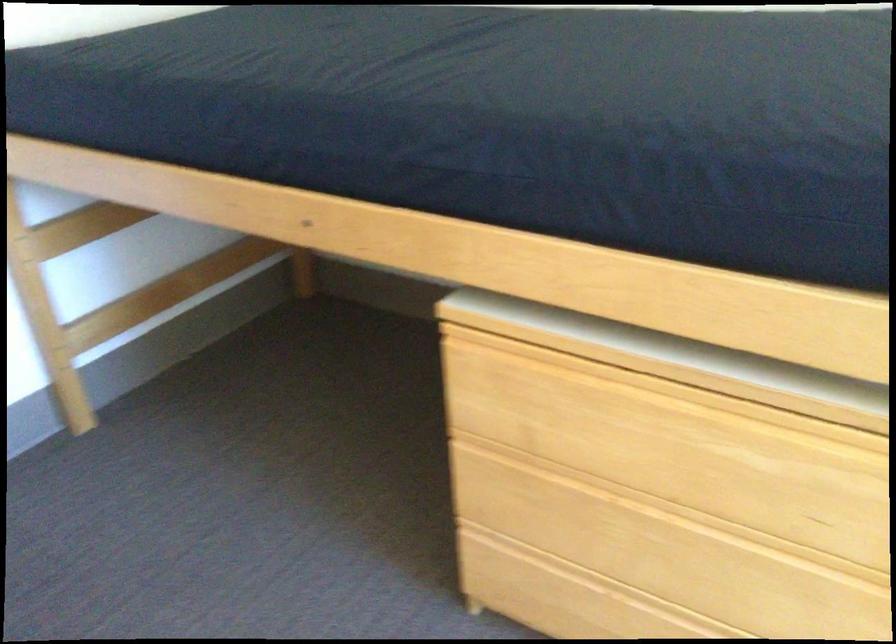
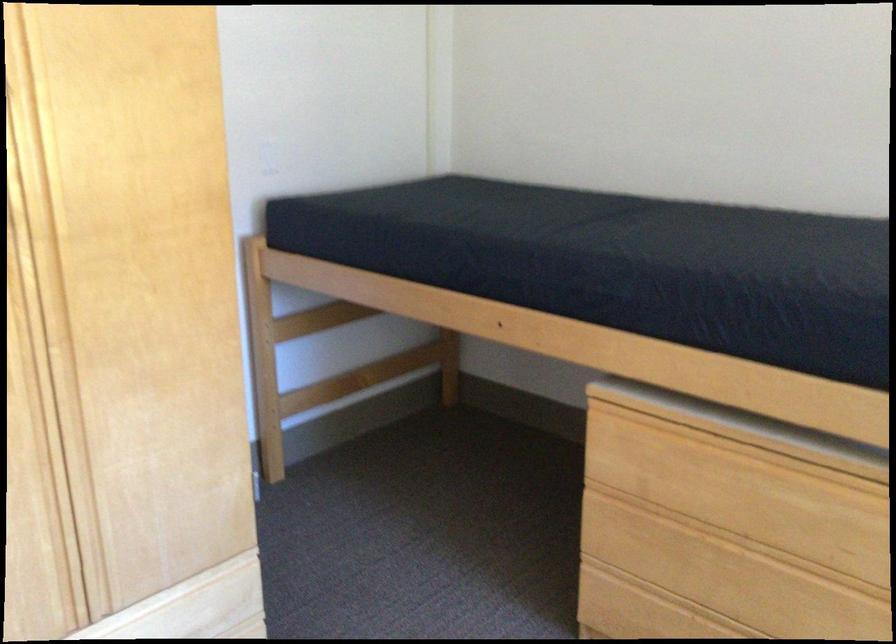
Find the pixel in the second image that matches point 625,428 in the first image.

(728, 488)